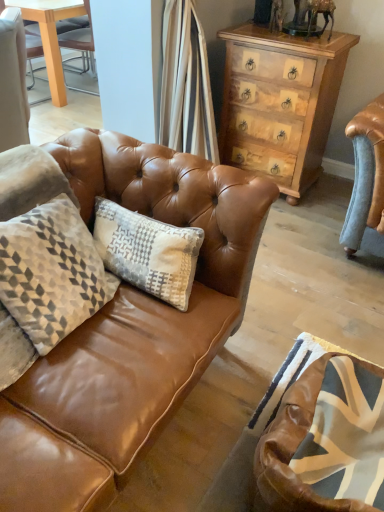
Locate an element on the screen. free space above matte brown leather couch at center (from a real-world perspective) is located at coordinates (294, 288).